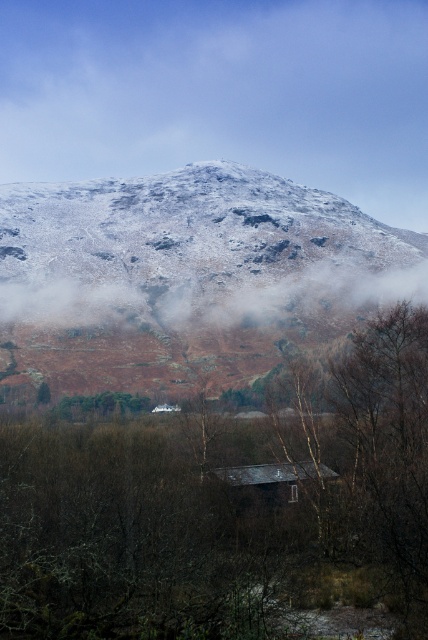
Question: Observing the image, what is the correct spatial positioning of brown matte tree at lower center in reference to snowy rock mountain at upper center?

Choices:
 (A) below
 (B) above

Answer: (A)

Question: Where is brown matte tree at lower center located in relation to white snow-covered mountain at upper center in the image?

Choices:
 (A) right
 (B) left

Answer: (A)

Question: Which point is farther to the camera?

Choices:
 (A) (32, 323)
 (B) (410, 282)
 (C) (276, 502)

Answer: (B)

Question: Which of the following is the farthest from the observer?

Choices:
 (A) snowy rock mountain at upper center
 (B) brown matte tree at lower center
 (C) dark brown wooden hut at center
 (D) white snow-covered mountain at upper center

Answer: (D)

Question: Which point is farther to the camera?

Choices:
 (A) (181, 272)
 (B) (282, 592)
 (C) (320, 499)
 (D) (309, 22)

Answer: (D)

Question: Does white snow-covered mountain at upper center have a greater width compared to dark brown wooden hut at center?

Choices:
 (A) yes
 (B) no

Answer: (A)